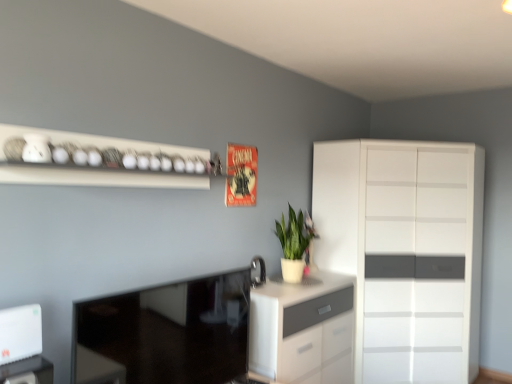
Question: Can we say glossy black tv at lower left lies outside white glossy cupboard at right?

Choices:
 (A) yes
 (B) no

Answer: (A)

Question: Does glossy black tv at lower left come behind white glossy cupboard at right?

Choices:
 (A) yes
 (B) no

Answer: (B)

Question: Does glossy black tv at lower left lie in front of white glossy cupboard at right?

Choices:
 (A) no
 (B) yes

Answer: (B)

Question: Can you confirm if glossy black tv at lower left is smaller than white glossy cupboard at right?

Choices:
 (A) yes
 (B) no

Answer: (A)

Question: Considering the relative positions of glossy black tv at lower left and white glossy cupboard at right in the image provided, is glossy black tv at lower left to the left of white glossy cupboard at right from the viewer's perspective?

Choices:
 (A) no
 (B) yes

Answer: (B)

Question: Does glossy black tv at lower left turn towards white glossy cupboard at right?

Choices:
 (A) no
 (B) yes

Answer: (A)

Question: Can you confirm if white glossy shelf at upper left is positioned to the left of white matte chest of drawers at center?

Choices:
 (A) no
 (B) yes

Answer: (B)

Question: Is there a large distance between white glossy shelf at upper left and white matte chest of drawers at center?

Choices:
 (A) no
 (B) yes

Answer: (B)

Question: From a real-world perspective, is white glossy shelf at upper left beneath white matte chest of drawers at center?

Choices:
 (A) yes
 (B) no

Answer: (B)

Question: Is white glossy shelf at upper left further to camera compared to white matte chest of drawers at center?

Choices:
 (A) no
 (B) yes

Answer: (A)

Question: Can you confirm if white glossy shelf at upper left is smaller than white matte chest of drawers at center?

Choices:
 (A) yes
 (B) no

Answer: (A)

Question: Is white matte chest of drawers at center completely or partially inside white glossy shelf at upper left?

Choices:
 (A) no
 (B) yes

Answer: (A)

Question: Considering the relative sizes of white plastic router at lower left, which is the 1th appliance in left-to-right order, and satin nickel faucet at center, which is counted as the second appliance, starting from the front, in the image provided, is white plastic router at lower left, which is the 1th appliance in left-to-right order, wider than satin nickel faucet at center, which is counted as the second appliance, starting from the front,?

Choices:
 (A) no
 (B) yes

Answer: (B)